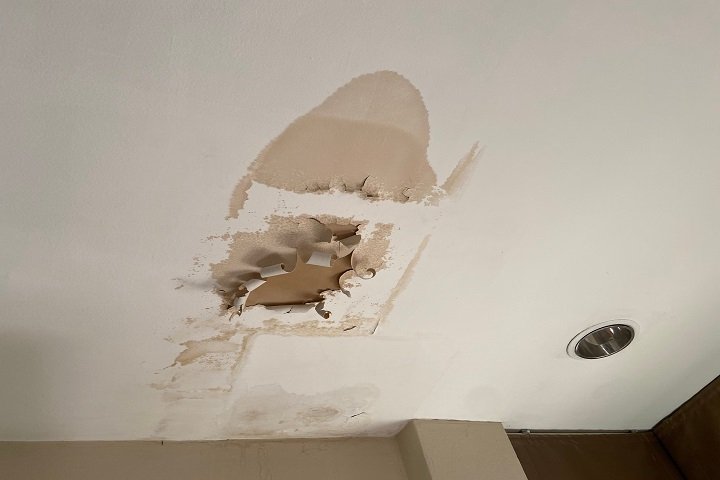
Identify the location of middle of pot light. This screenshot has height=480, width=720. (602, 340).